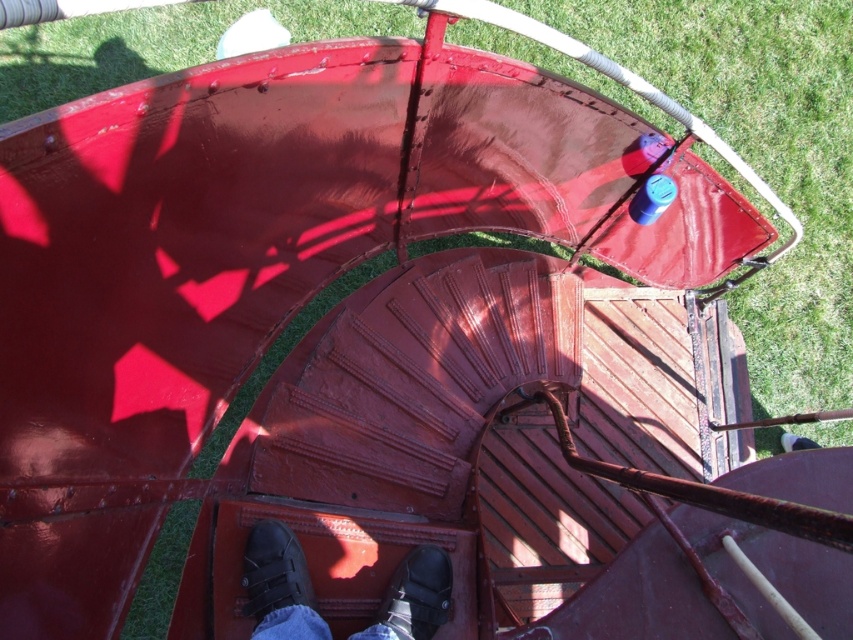
From the picture: Between black leather shoe at center and black leather shoe at lower center, which one appears on the left side from the viewer's perspective?

From the viewer's perspective, black leather shoe at center appears more on the left side.

Can you confirm if black leather shoe at center is taller than black leather shoe at lower center?

Correct, black leather shoe at center is much taller as black leather shoe at lower center.

What do you see at coordinates (274, 570) in the screenshot?
I see `black leather shoe at center` at bounding box center [274, 570].

Where is `black leather shoe at center`? black leather shoe at center is located at coordinates (274, 570).

What do you see at coordinates (274, 572) in the screenshot? This screenshot has height=640, width=853. I see `black leather shoes at center` at bounding box center [274, 572].

Which is in front, point (405, 589) or point (274, 532)?

Point (405, 589) is in front.

Identify the location of black leather shoes at center. (274, 572).

Does point (372, 339) come in front of point (265, 600)?

No, (372, 339) is behind (265, 600).

Does rusty metal stairs at center appear over black leather shoe at center?

Correct, rusty metal stairs at center is located above black leather shoe at center.

In order to click on rusty metal stairs at center in this screenshot , I will do `click(415, 380)`.

Locate an element on the screen. rusty metal stairs at center is located at coordinates (415, 380).